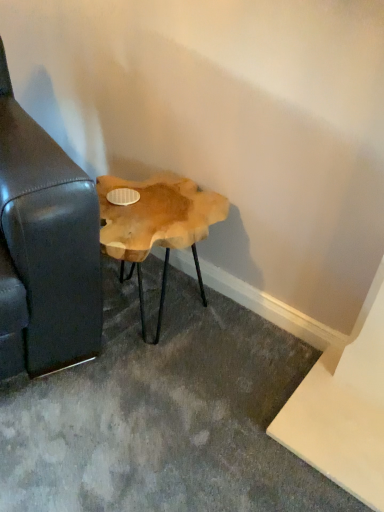
Question: Considering the positions of black leather couch at left and natural wood side table at lower left in the image, is black leather couch at left bigger or smaller than natural wood side table at lower left?

Choices:
 (A) small
 (B) big

Answer: (B)

Question: Is black leather couch at left situated inside natural wood side table at lower left or outside?

Choices:
 (A) inside
 (B) outside

Answer: (B)

Question: In the image, is black leather couch at left on the left side or the right side of natural wood side table at lower left?

Choices:
 (A) left
 (B) right

Answer: (A)

Question: From the image's perspective, is natural wood side table at lower left positioned above or below black leather couch at left?

Choices:
 (A) above
 (B) below

Answer: (B)

Question: From a real-world perspective, relative to black leather couch at left, is natural wood side table at lower left vertically above or below?

Choices:
 (A) above
 (B) below

Answer: (B)

Question: Would you say natural wood side table at lower left is to the left or to the right of black leather couch at left in the picture?

Choices:
 (A) left
 (B) right

Answer: (B)

Question: Is natural wood side table at lower left wider or thinner than black leather couch at left?

Choices:
 (A) wide
 (B) thin

Answer: (B)